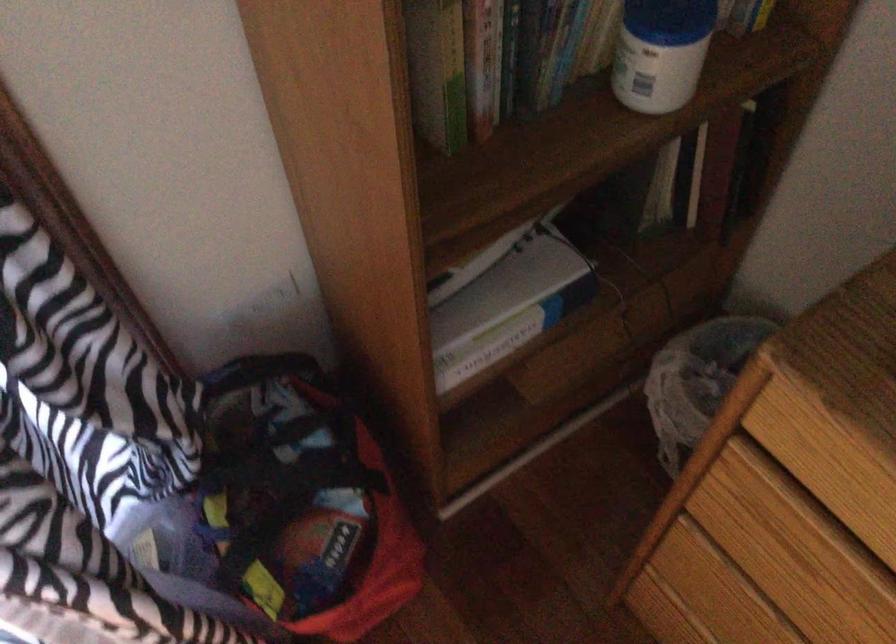
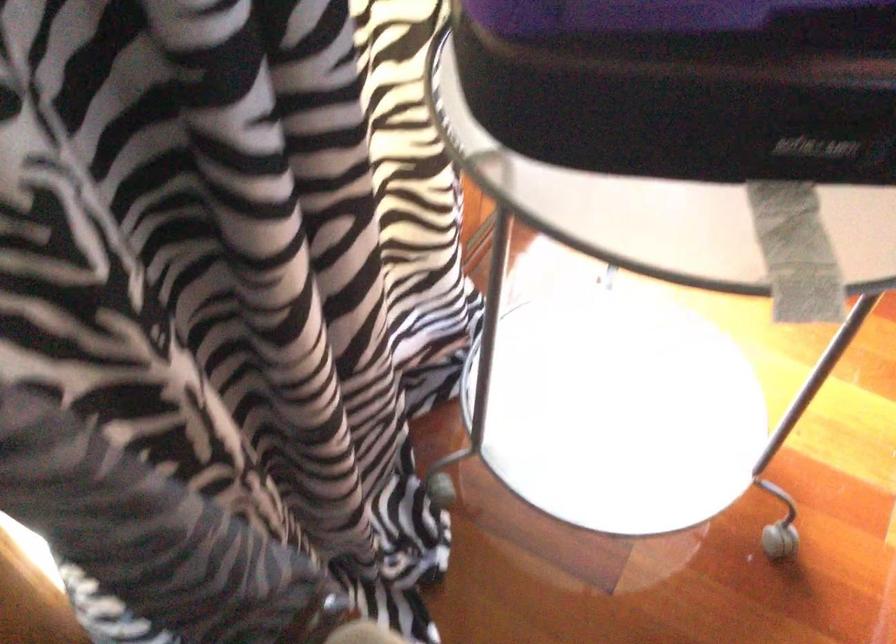
Question: The images are taken continuously from a first-person perspective. In which direction are you moving?

Choices:
 (A) Left
 (B) Right
 (C) Forward
 (D) Backward

Answer: (A)